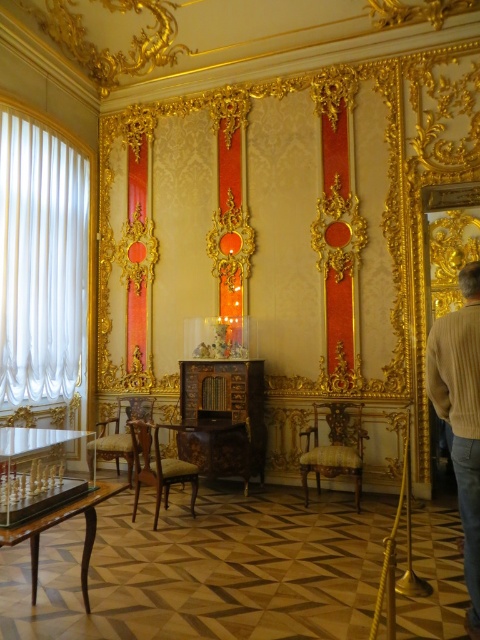
Is light brown sweater at right bigger than wooden polished chair at center?

Actually, light brown sweater at right might be smaller than wooden polished chair at center.

Is light brown sweater at right closer to camera compared to wooden polished chair at center?

Yes, light brown sweater at right is closer to the viewer.

Is point (470, 417) positioned behind point (128, 422)?

No, (470, 417) is in front of (128, 422).

Where is `light brown sweater at right`? The height and width of the screenshot is (640, 480). light brown sweater at right is located at coordinates (460, 417).

Can you confirm if white sheer curtain at left is shorter than light brown sweater at right?

Incorrect, white sheer curtain at left's height does not fall short of light brown sweater at right's.

Which is behind, point (35, 346) or point (468, 353)?

Point (35, 346)

This screenshot has width=480, height=640. What do you see at coordinates (41, 257) in the screenshot?
I see `white sheer curtain at left` at bounding box center [41, 257].

Identify the location of white sheer curtain at left. This screenshot has height=640, width=480. (41, 257).

Does gold/gilded mirror at right have a lesser height compared to wooden polished chair at center?

No, gold/gilded mirror at right is not shorter than wooden polished chair at center.

Is gold/gilded mirror at right smaller than wooden polished chair at center?

Yes, gold/gilded mirror at right is smaller than wooden polished chair at center.

Is point (458, 260) in front of point (135, 456)?

No.

Image resolution: width=480 pixels, height=640 pixels. I want to click on gold/gilded mirror at right, so click(447, 241).